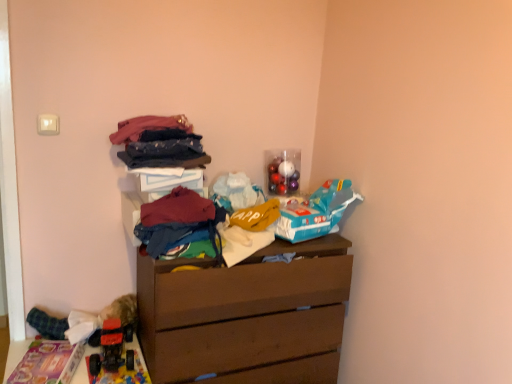
Locate an element on the screen. The width and height of the screenshot is (512, 384). dark blue denim jeans at center, which is the third clothing from bottom to top is located at coordinates (166, 160).

Find the location of a particular element. The image size is (512, 384). rubberized red toy truck at lower left, which is counted as the 1th toy, starting from the bottom is located at coordinates (110, 347).

What is the approximate width of plastic toy car at lower left?

The width of plastic toy car at lower left is 18.32 inches.

The width and height of the screenshot is (512, 384). What do you see at coordinates (15, 356) in the screenshot?
I see `plastic toy car at lower left` at bounding box center [15, 356].

Image resolution: width=512 pixels, height=384 pixels. I want to click on maroon fabric at center, which ranks as the second clothing in bottom-to-top order, so click(178, 208).

In order to click on dark blue denim jeans at center, which is the third clothing from bottom to top in this screenshot , I will do (166, 160).

Is blue matte toy airplane at upper right, the 4th toy in the left-to-right sequence, located within shiny metallic ornaments at upper right, the second toy in the right-to-left sequence?

No, shiny metallic ornaments at upper right, the second toy in the right-to-left sequence, does not contain blue matte toy airplane at upper right, the 4th toy in the left-to-right sequence.

Are shiny metallic ornaments at upper right, which is counted as the 3th toy, starting from the left, and blue matte toy airplane at upper right, positioned as the second toy in top-to-bottom order, located far from each other?

shiny metallic ornaments at upper right, which is counted as the 3th toy, starting from the left, is actually quite close to blue matte toy airplane at upper right, positioned as the second toy in top-to-bottom order.

Considering the positions of point (287, 163) and point (334, 192), is point (287, 163) closer or farther from the camera than point (334, 192)?

Point (287, 163) appears to be farther away from the viewer than point (334, 192).

Is shiny metallic ornaments at upper right, which is counted as the 3th toy, starting from the left, oriented away from blue matte toy airplane at upper right, positioned as the second toy in top-to-bottom order?

No, blue matte toy airplane at upper right, positioned as the second toy in top-to-bottom order, is not at the back of shiny metallic ornaments at upper right, which is counted as the 3th toy, starting from the left.

Can you confirm if matte pink fabric at upper center, which appears as the first clothing when viewed from the top, is thinner than dark blue denim jeans at center, which is the 3th clothing from top to bottom?

In fact, matte pink fabric at upper center, which appears as the first clothing when viewed from the top, might be wider than dark blue denim jeans at center, which is the 3th clothing from top to bottom.

Can you confirm if matte pink fabric at upper center, which is the 5th clothing in bottom-to-top order, is bigger than dark blue denim jeans at center, which is the 3th clothing from top to bottom?

Correct, matte pink fabric at upper center, which is the 5th clothing in bottom-to-top order, is larger in size than dark blue denim jeans at center, which is the 3th clothing from top to bottom.

Considering the relative sizes of matte pink fabric at upper center, which is the 5th clothing in bottom-to-top order, and dark blue denim jeans at center, which is the 3th clothing from top to bottom, in the image provided, is matte pink fabric at upper center, which is the 5th clothing in bottom-to-top order, taller than dark blue denim jeans at center, which is the 3th clothing from top to bottom,?

Indeed, matte pink fabric at upper center, which is the 5th clothing in bottom-to-top order, has a greater height compared to dark blue denim jeans at center, which is the 3th clothing from top to bottom.

The height and width of the screenshot is (384, 512). Identify the location of chest of drawers below the dark blue denim jeans at center, which is the 3th clothing from top to bottom (from a real-world perspective). (247, 315).

From the image's perspective, is brown matte chest of drawers at center above or below dark blue denim jeans at center, which is the third clothing from bottom to top?

Clearly, from the image's perspective, brown matte chest of drawers at center is below dark blue denim jeans at center, which is the third clothing from bottom to top.

Considering the sizes of objects brown matte chest of drawers at center and dark blue denim jeans at center, which is the third clothing from bottom to top, in the image provided, who is thinner, brown matte chest of drawers at center or dark blue denim jeans at center, which is the third clothing from bottom to top,?

dark blue denim jeans at center, which is the third clothing from bottom to top.

Based on the photo, is brown matte chest of drawers at center not inside plastic toy car at lower left?

Yes, brown matte chest of drawers at center is outside of plastic toy car at lower left.

From the image's perspective, is brown matte chest of drawers at center located above or below plastic toy car at lower left?

brown matte chest of drawers at center is above plastic toy car at lower left.

Is the surface of brown matte chest of drawers at center in direct contact with plastic toy car at lower left?

No.

Considering the sizes of objects brown matte chest of drawers at center and plastic toy car at lower left in the image provided, who is taller, brown matte chest of drawers at center or plastic toy car at lower left?

brown matte chest of drawers at center.

Considering their positions, is rubberized red toy truck at lower left, placed as the third toy when sorted from right to left, located in front of or behind matte pink fabric at upper center, which appears as the first clothing when viewed from the top?

In the image, rubberized red toy truck at lower left, placed as the third toy when sorted from right to left, appears behind matte pink fabric at upper center, which appears as the first clothing when viewed from the top.

Is rubberized red toy truck at lower left, placed as the third toy when sorted from right to left, not inside matte pink fabric at upper center, which is the 5th clothing in bottom-to-top order?

Yes.

The image size is (512, 384). I want to click on toy that is the 4th one below the matte pink fabric at upper center, which appears as the first clothing when viewed from the top (from a real-world perspective), so 110,347.

From the image's perspective, would you say rubberized red toy truck at lower left, which is counted as the 1th toy, starting from the bottom, is positioned over matte pink fabric at upper center, which is the 5th clothing in bottom-to-top order?

Actually, rubberized red toy truck at lower left, which is counted as the 1th toy, starting from the bottom, appears below matte pink fabric at upper center, which is the 5th clothing in bottom-to-top order, in the image.

From the image's perspective, which is above, plastic toy car at lower left or denim jeans at upper center, placed as the 4th clothing when sorted from bottom to top?

denim jeans at upper center, placed as the 4th clothing when sorted from bottom to top, appears higher in the image.

Can you confirm if plastic toy car at lower left is positioned to the left of denim jeans at upper center, placed as the 4th clothing when sorted from bottom to top?

Yes, plastic toy car at lower left is to the left of denim jeans at upper center, placed as the 4th clothing when sorted from bottom to top.

Which of these two, plastic toy car at lower left or denim jeans at upper center, placed as the 4th clothing when sorted from bottom to top, is smaller?

denim jeans at upper center, placed as the 4th clothing when sorted from bottom to top, is smaller.

Looking at this image, considering the relative positions of blue matte toy airplane at upper right, arranged as the third toy when ordered from the bottom, and dark blue denim jeans at center, which is the third clothing from bottom to top, in the image provided, is blue matte toy airplane at upper right, arranged as the third toy when ordered from the bottom, to the left of dark blue denim jeans at center, which is the third clothing from bottom to top, from the viewer's perspective?

Incorrect, blue matte toy airplane at upper right, arranged as the third toy when ordered from the bottom, is not on the left side of dark blue denim jeans at center, which is the third clothing from bottom to top.

Can you confirm if blue matte toy airplane at upper right, the first toy viewed from the right, is wider than dark blue denim jeans at center, which is the 3th clothing from top to bottom?

Correct, the width of blue matte toy airplane at upper right, the first toy viewed from the right, exceeds that of dark blue denim jeans at center, which is the 3th clothing from top to bottom.

From the image's perspective, is blue matte toy airplane at upper right, arranged as the third toy when ordered from the bottom, located above or below dark blue denim jeans at center, which is the 3th clothing from top to bottom?

Clearly, from the image's perspective, blue matte toy airplane at upper right, arranged as the third toy when ordered from the bottom, is below dark blue denim jeans at center, which is the 3th clothing from top to bottom.

From a real-world perspective, starting from the dark blue denim jeans at center, which is the third clothing from bottom to top, which toy is the 2nd one below it? Please provide its 2D coordinates.

[(316, 212)]

Identify the location of the 1st toy to the left when counting from the blue matte toy airplane at upper right, positioned as the second toy in top-to-bottom order. (283, 172).

The image size is (512, 384). In order to click on the 2nd clothing located beneath the matte pink fabric at upper center, which appears as the first clothing when viewed from the top (from a real-world perspective) in this screenshot , I will do `click(166, 160)`.

Based on the photo, from the image, which object appears to be farther from plush fabric toy at lower left, the second toy positioned from the bottom, rubberized red toy truck at lower left, which ranks as the 2th toy in left-to-right order, or blue matte toy airplane at upper right, positioned as the second toy in top-to-bottom order?

The object further to plush fabric toy at lower left, the second toy positioned from the bottom, is blue matte toy airplane at upper right, positioned as the second toy in top-to-bottom order.

In the scene shown: Considering their positions, is dark blue denim jeans at center, which is the 3th clothing from top to bottom, positioned further to blue matte toy airplane at upper right, the first toy viewed from the right, than brown matte chest of drawers at center?

dark blue denim jeans at center, which is the 3th clothing from top to bottom.

When comparing their distances from dark blue denim jeans at center, which is the 3th clothing from top to bottom, does plastic toy car at lower left or multicolored fabric pile at center, the first clothing in the bottom-to-top sequence, seem further?

plastic toy car at lower left.

When comparing their distances from plush fabric toy at lower left, which ranks as the fourth toy in right-to-left order, does shiny metallic ornaments at upper right, the second toy in the right-to-left sequence, or matte pink fabric at upper center, which appears as the first clothing when viewed from the top, seem further?

Based on the image, shiny metallic ornaments at upper right, the second toy in the right-to-left sequence, appears to be further to plush fabric toy at lower left, which ranks as the fourth toy in right-to-left order.

When comparing their distances from blue matte toy airplane at upper right, positioned as the second toy in top-to-bottom order, does denim jeans at upper center, placed as the 4th clothing when sorted from bottom to top, or dark blue denim jeans at center, which is the third clothing from bottom to top, seem further?

denim jeans at upper center, placed as the 4th clothing when sorted from bottom to top.

Based on their spatial positions, is brown matte chest of drawers at center or plastic toy car at lower left further from matte pink fabric at upper center, which appears as the first clothing when viewed from the top?

plastic toy car at lower left lies further to matte pink fabric at upper center, which appears as the first clothing when viewed from the top, than the other object.

Based on their spatial positions, is dark blue denim jeans at center, which is the third clothing from bottom to top, or plastic toy car at lower left closer to plush fabric toy at lower left, which is the third toy in top-to-bottom order?

plastic toy car at lower left is positioned closer to the anchor plush fabric toy at lower left, which is the third toy in top-to-bottom order.

Based on their spatial positions, is dark blue denim jeans at center, which is the 3th clothing from top to bottom, or brown matte chest of drawers at center further from denim jeans at upper center, which is the 2th clothing from top to bottom?

The object further to denim jeans at upper center, which is the 2th clothing from top to bottom, is brown matte chest of drawers at center.

You are a GUI agent. You are given a task and a screenshot of the screen. Output one action in this format:
    pyautogui.click(x=<x>, y=<y>)
    Task: Click on the toy between plush fabric toy at lower left, the 1th toy viewed from the left, and plastic toy car at lower left, in the vertical direction
    This screenshot has width=512, height=384.
    Given the screenshot: What is the action you would take?
    pyautogui.click(x=110, y=347)

I want to click on toy located between plush fabric toy at lower left, the second toy positioned from the bottom, and shiny metallic ornaments at upper right, the second toy in the right-to-left sequence, in the left-right direction, so click(x=110, y=347).

In order to click on clothing between dark blue denim jeans at center, which is the 3th clothing from top to bottom, and multicolored fabric pile at center, marked as the fifth clothing in a top-to-bottom arrangement, from top to bottom in this screenshot , I will do `click(178, 208)`.

Locate an element on the screen. toy between rubberized red toy truck at lower left, which is counted as the 1th toy, starting from the bottom, and blue matte toy airplane at upper right, the 4th toy in the left-to-right sequence, from left to right is located at coordinates (283, 172).